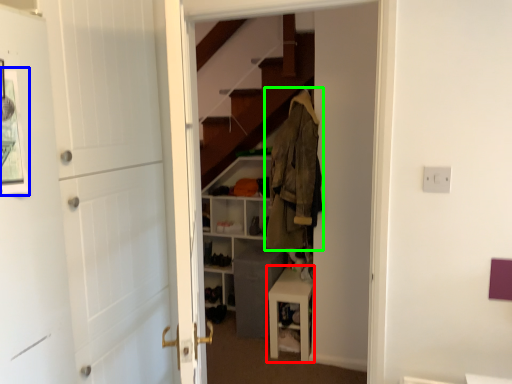
Question: Based on their relative distances, which object is farther from table (highlighted by a red box)? Choose from picture frame (highlighted by a blue box) and clothing (highlighted by a green box).

Choices:
 (A) picture frame
 (B) clothing

Answer: (A)